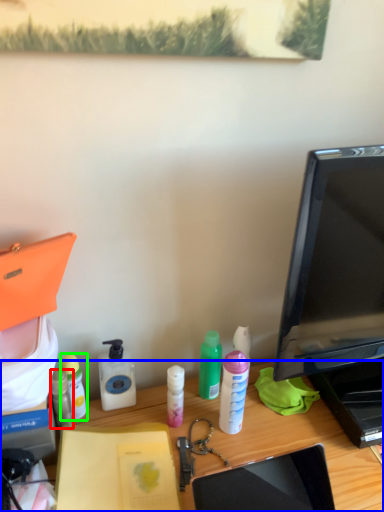
Question: Estimate the real-world distances between objects in this image. Which object is farther from bottle (highlighted by a red box), desk (highlighted by a blue box) or bottle (highlighted by a green box)?

Choices:
 (A) desk
 (B) bottle

Answer: (A)